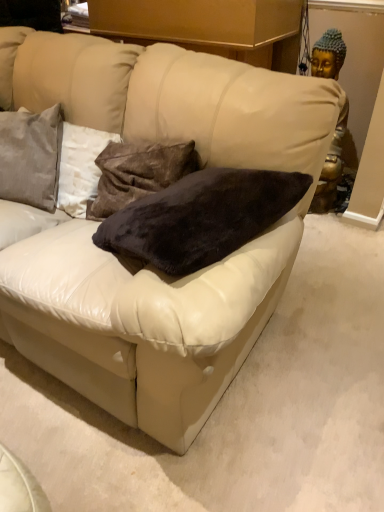
What do you see at coordinates (31, 156) in the screenshot?
I see `satin gray pillow at upper left, placed as the first pillow when sorted from left to right` at bounding box center [31, 156].

At what (x,y) coordinates should I click in order to perform the action: click on satin gray pillow at upper left, placed as the first pillow when sorted from left to right. Please return your answer as a coordinate pair (x, y). The width and height of the screenshot is (384, 512). Looking at the image, I should click on (31, 156).

This screenshot has height=512, width=384. I want to click on velvety brown pillow at center, which appears as the second pillow when viewed from the left, so pos(138,173).

How much space does velvety brown pillow at center, marked as the first pillow in a right-to-left arrangement, occupy horizontally?

8.84 inches.

The height and width of the screenshot is (512, 384). What do you see at coordinates (138, 173) in the screenshot? I see `velvety brown pillow at center, which appears as the second pillow when viewed from the left` at bounding box center [138, 173].

How much space does velvety brown pillow at center, marked as the first pillow in a right-to-left arrangement, occupy vertically?

velvety brown pillow at center, marked as the first pillow in a right-to-left arrangement, is 14.50 inches tall.

Identify the location of satin gray pillow at upper left, which is counted as the second pillow, starting from the right. Image resolution: width=384 pixels, height=512 pixels. (31, 156).

Between velvety brown pillow at center, marked as the first pillow in a right-to-left arrangement, and satin gray pillow at upper left, which is counted as the second pillow, starting from the right, which one appears on the right side from the viewer's perspective?

velvety brown pillow at center, marked as the first pillow in a right-to-left arrangement.

Which object is closer to the camera taking this photo, velvety brown pillow at center, marked as the first pillow in a right-to-left arrangement, or satin gray pillow at upper left, which is counted as the second pillow, starting from the right?

velvety brown pillow at center, marked as the first pillow in a right-to-left arrangement, is closer to the camera.

Is point (164, 161) farther from viewer compared to point (45, 139)?

No, it is in front of (45, 139).

From the image's perspective, which one is positioned lower, velvety brown pillow at center, which appears as the second pillow when viewed from the left, or satin gray pillow at upper left, placed as the first pillow when sorted from left to right?

velvety brown pillow at center, which appears as the second pillow when viewed from the left, is shown below in the image.

From a real-world perspective, between velvety brown pillow at center, marked as the first pillow in a right-to-left arrangement, and satin gray pillow at upper left, which is counted as the second pillow, starting from the right, who is vertically lower?

velvety brown pillow at center, marked as the first pillow in a right-to-left arrangement, from a real-world perspective.

Considering the sizes of objects velvety brown pillow at center, marked as the first pillow in a right-to-left arrangement, and satin gray pillow at upper left, placed as the first pillow when sorted from left to right, in the image provided, who is thinner, velvety brown pillow at center, marked as the first pillow in a right-to-left arrangement, or satin gray pillow at upper left, placed as the first pillow when sorted from left to right,?

velvety brown pillow at center, marked as the first pillow in a right-to-left arrangement.

Considering the relative sizes of velvety brown pillow at center, which appears as the second pillow when viewed from the left, and satin gray pillow at upper left, which is counted as the second pillow, starting from the right, in the image provided, is velvety brown pillow at center, which appears as the second pillow when viewed from the left, shorter than satin gray pillow at upper left, which is counted as the second pillow, starting from the right,?

In fact, velvety brown pillow at center, which appears as the second pillow when viewed from the left, may be taller than satin gray pillow at upper left, which is counted as the second pillow, starting from the right.

Considering the sizes of velvety brown pillow at center, which appears as the second pillow when viewed from the left, and satin gray pillow at upper left, which is counted as the second pillow, starting from the right, in the image, is velvety brown pillow at center, which appears as the second pillow when viewed from the left, bigger or smaller than satin gray pillow at upper left, which is counted as the second pillow, starting from the right,?

Clearly, velvety brown pillow at center, which appears as the second pillow when viewed from the left, is smaller in size than satin gray pillow at upper left, which is counted as the second pillow, starting from the right.

Is velvety brown pillow at center, which appears as the second pillow when viewed from the left, located outside satin gray pillow at upper left, which is counted as the second pillow, starting from the right?

Yes.

Are velvety brown pillow at center, marked as the first pillow in a right-to-left arrangement, and satin gray pillow at upper left, which is counted as the second pillow, starting from the right, beside each other?

No, velvety brown pillow at center, marked as the first pillow in a right-to-left arrangement, is not beside satin gray pillow at upper left, which is counted as the second pillow, starting from the right.

Is velvety brown pillow at center, marked as the first pillow in a right-to-left arrangement, aimed at satin gray pillow at upper left, which is counted as the second pillow, starting from the right?

No, velvety brown pillow at center, marked as the first pillow in a right-to-left arrangement, is not oriented towards satin gray pillow at upper left, which is counted as the second pillow, starting from the right.

Measure the distance between velvety brown pillow at center, marked as the first pillow in a right-to-left arrangement, and satin gray pillow at upper left, which is counted as the second pillow, starting from the right.

A distance of 11.93 inches exists between velvety brown pillow at center, marked as the first pillow in a right-to-left arrangement, and satin gray pillow at upper left, which is counted as the second pillow, starting from the right.

Image resolution: width=384 pixels, height=512 pixels. I want to click on pillow located behind the velvety brown pillow at center, which appears as the second pillow when viewed from the left, so click(31, 156).

Which is more to the left, satin gray pillow at upper left, placed as the first pillow when sorted from left to right, or velvety brown pillow at center, which appears as the second pillow when viewed from the left?

Positioned to the left is satin gray pillow at upper left, placed as the first pillow when sorted from left to right.

Which object is closer to the camera taking this photo, satin gray pillow at upper left, placed as the first pillow when sorted from left to right, or velvety brown pillow at center, marked as the first pillow in a right-to-left arrangement?

Positioned in front is velvety brown pillow at center, marked as the first pillow in a right-to-left arrangement.

Is point (10, 137) closer to camera compared to point (156, 179)?

No, (10, 137) is behind (156, 179).

From the image's perspective, is satin gray pillow at upper left, placed as the first pillow when sorted from left to right, located beneath velvety brown pillow at center, marked as the first pillow in a right-to-left arrangement?

Actually, satin gray pillow at upper left, placed as the first pillow when sorted from left to right, appears above velvety brown pillow at center, marked as the first pillow in a right-to-left arrangement, in the image.

From a real-world perspective, between satin gray pillow at upper left, placed as the first pillow when sorted from left to right, and velvety brown pillow at center, marked as the first pillow in a right-to-left arrangement, who is vertically lower?

velvety brown pillow at center, marked as the first pillow in a right-to-left arrangement, from a real-world perspective.

Between satin gray pillow at upper left, which is counted as the second pillow, starting from the right, and velvety brown pillow at center, marked as the first pillow in a right-to-left arrangement, which one has larger width?

satin gray pillow at upper left, which is counted as the second pillow, starting from the right.

Can you confirm if satin gray pillow at upper left, placed as the first pillow when sorted from left to right, is shorter than velvety brown pillow at center, marked as the first pillow in a right-to-left arrangement?

Yes, satin gray pillow at upper left, placed as the first pillow when sorted from left to right, is shorter than velvety brown pillow at center, marked as the first pillow in a right-to-left arrangement.

Based on their sizes in the image, would you say satin gray pillow at upper left, which is counted as the second pillow, starting from the right, is bigger or smaller than velvety brown pillow at center, which appears as the second pillow when viewed from the left?

Considering their sizes, satin gray pillow at upper left, which is counted as the second pillow, starting from the right, takes up more space than velvety brown pillow at center, which appears as the second pillow when viewed from the left.

Is satin gray pillow at upper left, placed as the first pillow when sorted from left to right, located outside velvety brown pillow at center, which appears as the second pillow when viewed from the left?

Yes, satin gray pillow at upper left, placed as the first pillow when sorted from left to right, is outside of velvety brown pillow at center, which appears as the second pillow when viewed from the left.

Is satin gray pillow at upper left, which is counted as the second pillow, starting from the right, positioned far away from velvety brown pillow at center, which appears as the second pillow when viewed from the left?

That's not correct — satin gray pillow at upper left, which is counted as the second pillow, starting from the right, is a little close to velvety brown pillow at center, which appears as the second pillow when viewed from the left.

From the picture: Is velvety brown pillow at center, which appears as the second pillow when viewed from the left, at the back of satin gray pillow at upper left, which is counted as the second pillow, starting from the right?

No, satin gray pillow at upper left, which is counted as the second pillow, starting from the right, is not facing the opposite direction of velvety brown pillow at center, which appears as the second pillow when viewed from the left.

How many degrees apart are the facing directions of satin gray pillow at upper left, which is counted as the second pillow, starting from the right, and velvety brown pillow at center, marked as the first pillow in a right-to-left arrangement?

22 degrees separate the facing orientations of satin gray pillow at upper left, which is counted as the second pillow, starting from the right, and velvety brown pillow at center, marked as the first pillow in a right-to-left arrangement.

This screenshot has width=384, height=512. In order to click on pillow behind the velvety brown pillow at center, marked as the first pillow in a right-to-left arrangement in this screenshot , I will do `click(31, 156)`.

Identify the location of pillow above the velvety brown pillow at center, marked as the first pillow in a right-to-left arrangement (from the image's perspective). Image resolution: width=384 pixels, height=512 pixels. (31, 156).

The width and height of the screenshot is (384, 512). I want to click on pillow on the left of velvety brown pillow at center, which appears as the second pillow when viewed from the left, so coord(31,156).